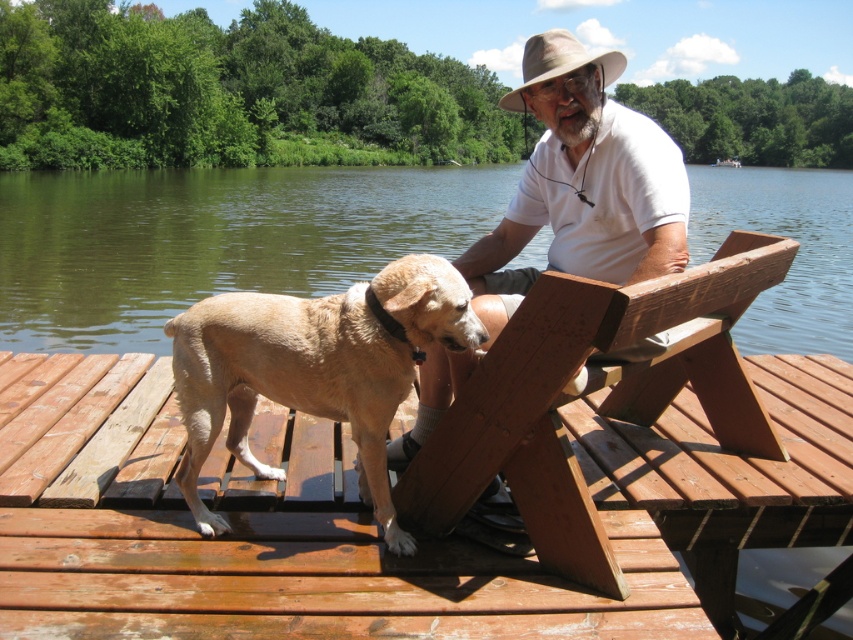
Question: Does wooden picnic table at center have a lesser width compared to light brown fur at center?

Choices:
 (A) no
 (B) yes

Answer: (A)

Question: Based on their relative distances, which object is nearer to the wooden picnic table at center?

Choices:
 (A) white matte shirt at center
 (B) light brown fur at center

Answer: (B)

Question: Does wooden picnic table at center have a smaller size compared to white matte shirt at center?

Choices:
 (A) no
 (B) yes

Answer: (A)

Question: Which object is farther from the camera taking this photo?

Choices:
 (A) light brown fur at center
 (B) brown water at center
 (C) white matte shirt at center
 (D) wooden picnic table at center

Answer: (B)

Question: Among these objects, which one is nearest to the camera?

Choices:
 (A) wooden picnic table at center
 (B) white matte shirt at center
 (C) light brown fur at center

Answer: (A)

Question: Is wooden picnic table at center below light brown fur at center?

Choices:
 (A) no
 (B) yes

Answer: (A)